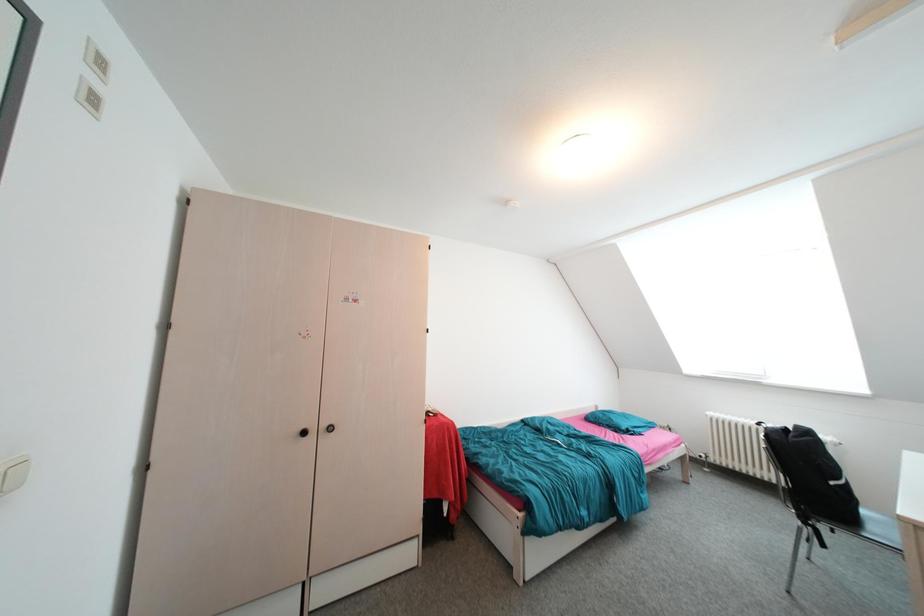
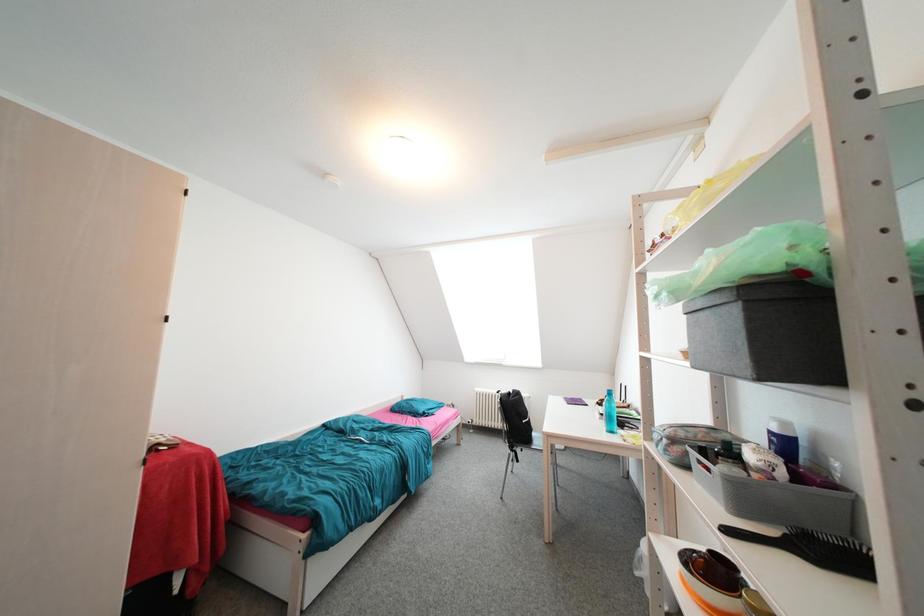
Question: The images are taken continuously from a first-person perspective. In which direction is your viewpoint rotating?

Choices:
 (A) Left
 (B) Right
 (C) Up
 (D) Down

Answer: (B)